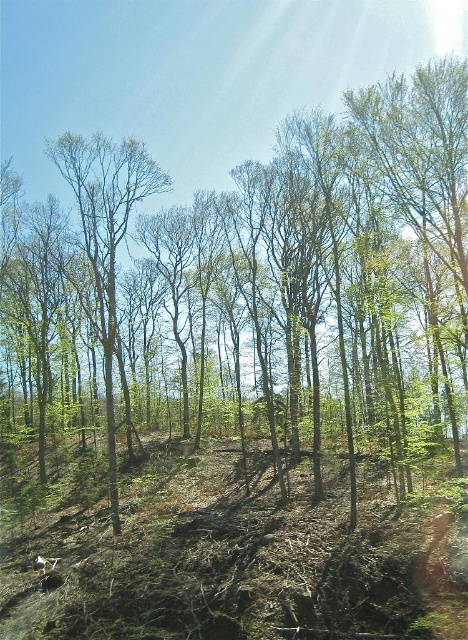
You are standing in a forest and want to walk to a specific point marked as point (302,486). If your walking speed is 1.5 meters per second, how many seconds will it take you to reach the point?

The distance between point (302,486) and the camera is 24.96 meters. At a walking speed of 1.5 meters per second, it will take approximately 16.64 seconds to reach the point.

You are a hiker who wants to place a 2 meter long wooden bench between the brown dirt at center and the green leafy tree at center. Can you fit the bench in that space without it overlapping either object?

The brown dirt at center is 6.67 meters away from the green leafy tree at center. Since the bench is only 2 meters long, there is enough space to place it between them without overlapping either object.

Consider the image. You are a hiker trying to determine the best path through the forest. You notice brown dirt at center and a green leafy tree at center. Which object is taller, and how might this affect your path choice?

The green leafy tree at center is taller than the brown dirt at center. Since the tree is taller, you might want to consider walking around it or staying on the path where the brown dirt at center is located to avoid obstacles.